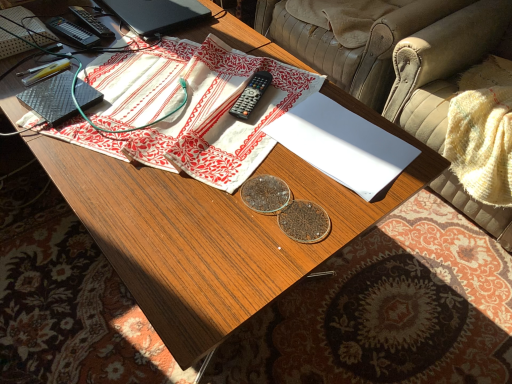
Locate an element on the screen. The width and height of the screenshot is (512, 384). empty space that is to the right of black matte laptop at upper left is located at coordinates (226, 32).